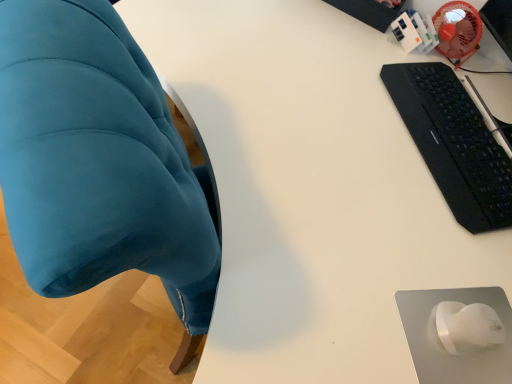
You are a GUI agent. You are given a task and a screenshot of the screen. Output one action in this format:
    pyautogui.click(x=<x>, y=<y>)
    Task: Click on the free location in front of black matte keyboard at right
    The image size is (512, 384).
    Given the screenshot: What is the action you would take?
    pyautogui.click(x=401, y=235)